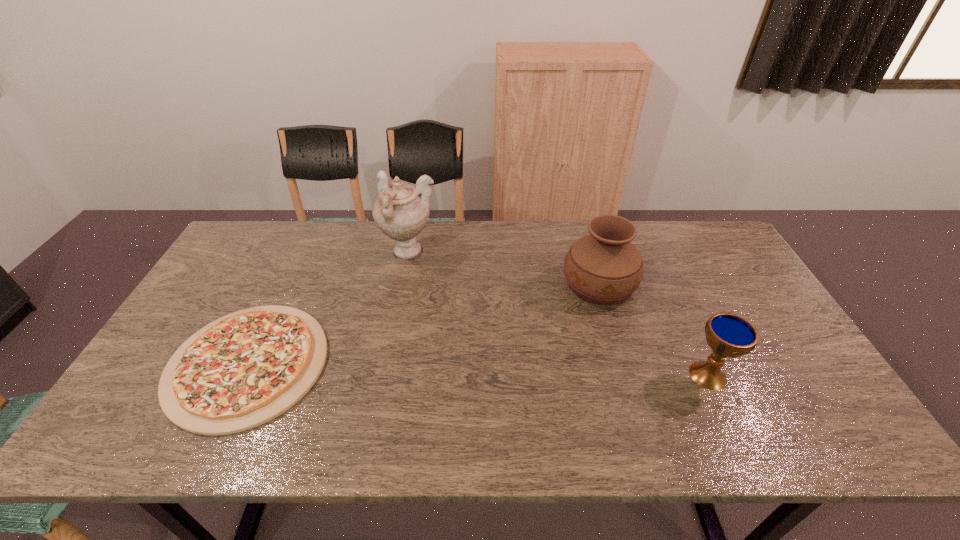
At what (x,y) coordinates should I click in order to perform the action: click on the tallest object. Please return your answer as a coordinate pair (x, y). Looking at the image, I should click on [x=401, y=211].

Locate an element on the screen. The image size is (960, 540). the second object from left to right is located at coordinates (401, 211).

This screenshot has width=960, height=540. I want to click on the right urn, so click(x=604, y=267).

Identify the location of the second object from right to left. (604, 267).

Locate an element on the screen. the second shortest object is located at coordinates (728, 335).

Image resolution: width=960 pixels, height=540 pixels. Identify the location of the rightmost object. (728, 335).

Locate an element on the screen. pizza is located at coordinates (244, 369).

This screenshot has height=540, width=960. What are the coordinates of `the shortest object` in the screenshot? It's located at (244, 369).

Identify the location of free point located 0.050m on the right of the taller urn. (453, 253).

The height and width of the screenshot is (540, 960). I want to click on vacant space situated 0.320m on the right of the right urn, so click(x=740, y=284).